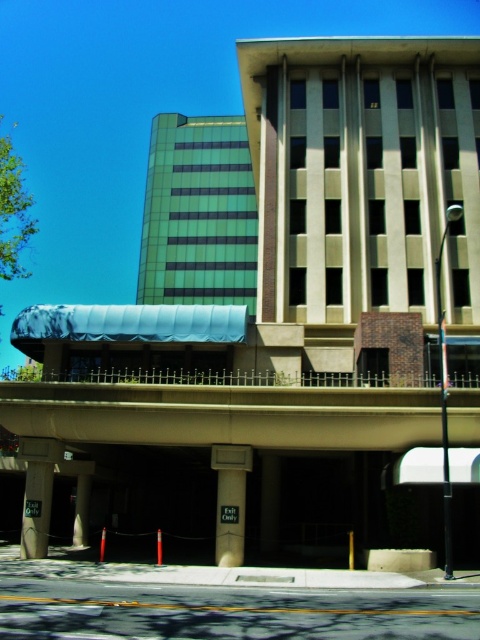
Question: Estimate the real-world distances between objects in this image. Which object is closer to the marble-like awning at center?

Choices:
 (A) smooth concrete pillar at lower left
 (B) white glossy pillar at center
 (C) concrete pillar at lower left

Answer: (B)

Question: Does marble-like awning at center have a greater width compared to white glossy pillar at center?

Choices:
 (A) no
 (B) yes

Answer: (B)

Question: Can you confirm if white glossy pillar at center is positioned below smooth concrete pillar at lower left?

Choices:
 (A) yes
 (B) no

Answer: (B)

Question: Which object is positioned closest to the smooth concrete pillar at lower left?

Choices:
 (A) concrete pillar at lower left
 (B) marble-like awning at center
 (C) white glossy pillar at center

Answer: (A)

Question: Based on their relative distances, which object is farther from the white glossy pillar at center?

Choices:
 (A) smooth concrete pillar at lower left
 (B) concrete pillar at lower left
 (C) marble-like awning at center

Answer: (A)

Question: Considering the relative positions of marble-like awning at center and smooth concrete pillar at lower left in the image provided, where is marble-like awning at center located with respect to smooth concrete pillar at lower left?

Choices:
 (A) right
 (B) left

Answer: (B)